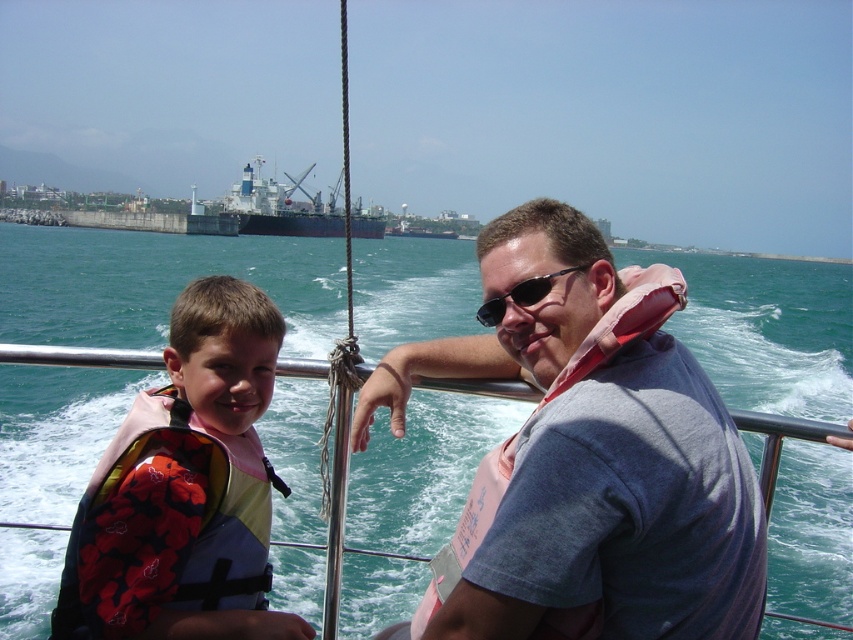
You are standing on the boat and want to look at the dark blue matte ship at center through your sunglasses at center. Can you see the ship clearly through the sunglasses?

The dark blue matte ship at center is further to the viewer than sunglasses at center, so yes, you can see the dark blue matte ship at center clearly through the sunglasses at center because the ship is in front of the sunglasses.

You are on a boat and need to quickly grab the closest life vest. Which one is closer to you? The gray fabric life vest at right or the multicolored life vest at left?

The gray fabric life vest at right is closer because it is in front of the multicolored life vest at left.